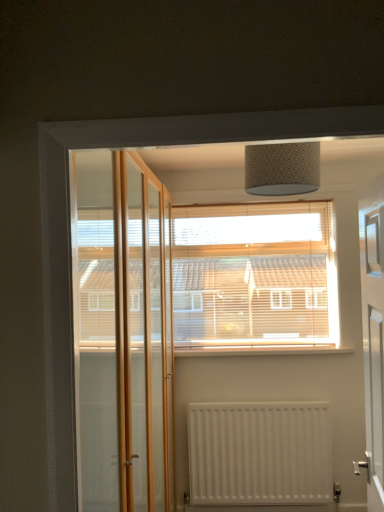
What do you see at coordinates (373, 347) in the screenshot?
I see `white glossy door at right` at bounding box center [373, 347].

The height and width of the screenshot is (512, 384). Find the location of `white glossy door at right`. white glossy door at right is located at coordinates (373, 347).

Considering the relative sizes of wooden blinds at center and white matte radiator at lower center in the image provided, is wooden blinds at center smaller than white matte radiator at lower center?

No, wooden blinds at center is not smaller than white matte radiator at lower center.

Measure the distance from wooden blinds at center to white matte radiator at lower center.

30.01 inches.

From the image's perspective, relative to white matte radiator at lower center, is wooden blinds at center above or below?

wooden blinds at center is above white matte radiator at lower center.

Is wooden blinds at center oriented towards white matte radiator at lower center?

No, wooden blinds at center does not turn towards white matte radiator at lower center.

Is white glossy door at right at the left side of white matte radiator at lower center?

No.

Who is taller, white glossy door at right or white matte radiator at lower center?

With more height is white glossy door at right.

Which object is closer to the camera, white glossy door at right or white matte radiator at lower center?

white glossy door at right is closer to the camera.

From the image's perspective, is white painted wood at center beneath white matte radiator at lower center?

No, from the image's perspective, white painted wood at center is not beneath white matte radiator at lower center.

Could you tell me if white painted wood at center is facing white matte radiator at lower center?

No, white painted wood at center is not facing towards white matte radiator at lower center.

Who is shorter, white painted wood at center or white matte radiator at lower center?

white painted wood at center is shorter.

From a real-world perspective, is white matte radiator at lower center below white painted wood at center?

Indeed, from a real-world perspective, white matte radiator at lower center is positioned beneath white painted wood at center.

From the image's perspective, between white matte radiator at lower center and white painted wood at center, who is located below?

white matte radiator at lower center, from the image's perspective.

Is white matte radiator at lower center turned away from white painted wood at center?

No, white matte radiator at lower center's orientation is not away from white painted wood at center.

Is white matte radiator at lower center positioned beyond the bounds of white painted wood at center?

Indeed, white matte radiator at lower center is completely outside white painted wood at center.

How different are the orientations of wooden blinds at center and white glossy door at right in degrees?

The angle between the facing direction of wooden blinds at center and the facing direction of white glossy door at right is 99.7 degrees.

From the image's perspective, is wooden blinds at center over white glossy door at right?

Yes, from the image's perspective, wooden blinds at center is on top of white glossy door at right.

From a real-world perspective, which object rests below the other?

In real-world perspective, white glossy door at right is lower.

How different are the orientations of white painted wood at center and white glossy door at right in degrees?

The angle between the facing direction of white painted wood at center and the facing direction of white glossy door at right is 99.7 degrees.

Relative to white glossy door at right, is white painted wood at center in front or behind?

In the image, white painted wood at center appears behind white glossy door at right.

Measure the distance from white painted wood at center to white glossy door at right.

A distance of 19.32 inches exists between white painted wood at center and white glossy door at right.

Is white painted wood at center positioned with its back to white glossy door at right?

No.

This screenshot has width=384, height=512. I want to click on elevator located in front of the wooden blinds at center, so click(x=373, y=347).

Which object is positioned more to the left, white glossy door at right or wooden blinds at center?

wooden blinds at center.

Measure the distance from white glossy door at right to wooden blinds at center.

The distance of white glossy door at right from wooden blinds at center is 24.41 inches.

Who is smaller, white glossy door at right or wooden blinds at center?

wooden blinds at center is smaller.

You are a GUI agent. You are given a task and a screenshot of the screen. Output one action in this format:
    pyautogui.click(x=<x>, y=<y>)
    Task: Click on the window lying behind the white matte radiator at lower center
    The height and width of the screenshot is (512, 384).
    Given the screenshot: What is the action you would take?
    pyautogui.click(x=254, y=276)

The height and width of the screenshot is (512, 384). Find the location of `elevator located above the white matte radiator at lower center (from the image's perspective)`. elevator located above the white matte radiator at lower center (from the image's perspective) is located at coordinates click(x=373, y=347).

Looking at the image, which one is located further to wooden blinds at center, white matte radiator at lower center or white glossy door at right?

Based on the image, white matte radiator at lower center appears to be further to wooden blinds at center.

From the image, which object appears to be nearer to wooden blinds at center, white glossy door at right or white painted wood at center?

white painted wood at center lies closer to wooden blinds at center than the other object.

Estimate the real-world distances between objects in this image. Which object is closer to white glossy door at right, white matte radiator at lower center or wooden blinds at center?

wooden blinds at center is closer to white glossy door at right.

Based on their spatial positions, is white glossy door at right or wooden blinds at center further from white matte radiator at lower center?

white glossy door at right lies further to white matte radiator at lower center than the other object.

Based on their spatial positions, is white matte radiator at lower center or wooden blinds at center closer to white painted wood at center?

wooden blinds at center.

From the image, which object appears to be nearer to white matte radiator at lower center, wooden blinds at center or white painted wood at center?

white painted wood at center.

Looking at the image, which one is located further to wooden blinds at center, white glossy door at right or white matte radiator at lower center?

The object further to wooden blinds at center is white matte radiator at lower center.

Based on their spatial positions, is white matte radiator at lower center or white painted wood at center further from wooden blinds at center?

white matte radiator at lower center is positioned further to the anchor wooden blinds at center.

Find the location of a particular element. window sill that lies between wooden blinds at center and white matte radiator at lower center from top to bottom is located at coordinates (258, 348).

You are a GUI agent. You are given a task and a screenshot of the screen. Output one action in this format:
    pyautogui.click(x=<x>, y=<y>)
    Task: Click on the radiator between white glossy door at right and wooden blinds at center from front to back
    
    Given the screenshot: What is the action you would take?
    pyautogui.click(x=259, y=454)

At what (x,y) coordinates should I click in order to perform the action: click on radiator between white glossy door at right and white painted wood at center from front to back. Please return your answer as a coordinate pair (x, y). Looking at the image, I should click on (259, 454).

Image resolution: width=384 pixels, height=512 pixels. I want to click on window sill between white glossy door at right and wooden blinds at center along the z-axis, so click(258, 348).